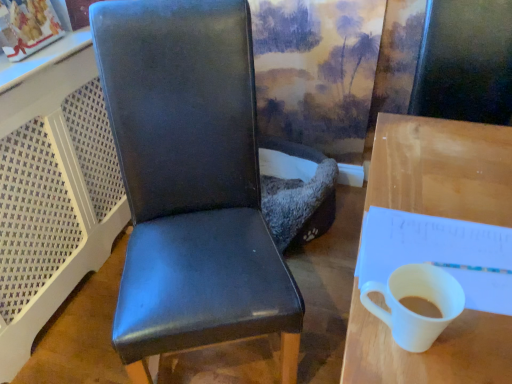
Question: Is wooden desk at right spatially inside white glossy mug at right, or outside of it?

Choices:
 (A) outside
 (B) inside

Answer: (A)

Question: From a real-world perspective, is wooden desk at right above or below white glossy mug at right?

Choices:
 (A) below
 (B) above

Answer: (A)

Question: Based on their relative distances, which object is farther from the white glossy mug at right?

Choices:
 (A) matte black chair at center
 (B) wooden desk at right
 (C) white paper notepad at right

Answer: (A)

Question: Estimate the real-world distances between objects in this image. Which object is farther from the wooden desk at right?

Choices:
 (A) white glossy mug at right
 (B) matte black chair at center
 (C) white paper notepad at right

Answer: (B)